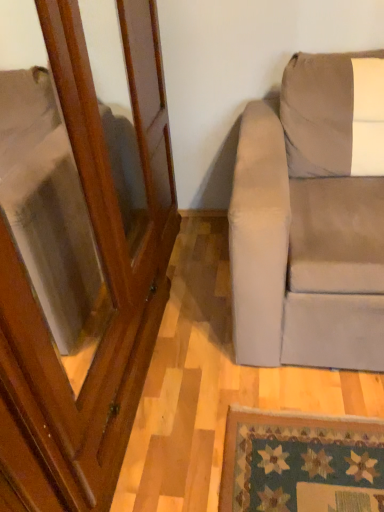
Locate an element on the screen. This screenshot has width=384, height=512. wooden screen door at left is located at coordinates (79, 261).

Image resolution: width=384 pixels, height=512 pixels. Describe the element at coordinates (79, 261) in the screenshot. I see `wooden screen door at left` at that location.

Where is `suede beige couch at right`? suede beige couch at right is located at coordinates (311, 218).

Measure the distance between suede beige couch at right and camera.

suede beige couch at right is 3.65 feet away from camera.

Describe the element at coordinates (311, 218) in the screenshot. This screenshot has width=384, height=512. I see `suede beige couch at right` at that location.

Where is `wooden screen door at left`? This screenshot has height=512, width=384. wooden screen door at left is located at coordinates (79, 261).

Based on the photo, which is more to the left, suede beige couch at right or wooden screen door at left?

Positioned to the left is wooden screen door at left.

Is suede beige couch at right positioned before wooden screen door at left?

No, suede beige couch at right is behind wooden screen door at left.

Does point (256, 346) appear closer or farther from the camera than point (114, 130)?

Point (256, 346) appears to be closer to the viewer than point (114, 130).

From the image's perspective, is suede beige couch at right above or below wooden screen door at left?

Clearly, from the image's perspective, suede beige couch at right is above wooden screen door at left.

From a real-world perspective, relative to wooden screen door at left, is suede beige couch at right vertically above or below?

From a real-world perspective, suede beige couch at right is physically below wooden screen door at left.

In terms of width, does suede beige couch at right look wider or thinner when compared to wooden screen door at left?

Clearly, suede beige couch at right has more width compared to wooden screen door at left.

Considering the sizes of objects suede beige couch at right and wooden screen door at left in the image provided, who is taller, suede beige couch at right or wooden screen door at left?

wooden screen door at left.

Who is bigger, suede beige couch at right or wooden screen door at left?

wooden screen door at left.

Is suede beige couch at right situated inside wooden screen door at left or outside?

The correct answer is: outside.

Are suede beige couch at right and wooden screen door at left making contact?

They are not placed beside each other.

Is suede beige couch at right positioned with its back to wooden screen door at left?

No, suede beige couch at right's orientation is not away from wooden screen door at left.

How far apart are suede beige couch at right and wooden screen door at left?

suede beige couch at right is 56.94 centimeters away from wooden screen door at left.

You are a GUI agent. You are given a task and a screenshot of the screen. Output one action in this format:
    pyautogui.click(x=<x>, y=<y>)
    Task: Click on the screen door lying below the suede beige couch at right (from the image's perspective)
    The width and height of the screenshot is (384, 512).
    Given the screenshot: What is the action you would take?
    pyautogui.click(x=79, y=261)

Between wooden screen door at left and suede beige couch at right, which one appears on the right side from the viewer's perspective?

suede beige couch at right.

Relative to suede beige couch at right, is wooden screen door at left in front or behind?

In the image, wooden screen door at left appears in front of suede beige couch at right.

Considering the points (51, 382) and (282, 185), which point is in front, point (51, 382) or point (282, 185)?

The point (51, 382) is closer.

From the image's perspective, would you say wooden screen door at left is shown under suede beige couch at right?

Indeed, from the image's perspective, wooden screen door at left is shown beneath suede beige couch at right.

From a real-world perspective, is wooden screen door at left under suede beige couch at right?

No.

Looking at their sizes, would you say wooden screen door at left is wider or thinner than suede beige couch at right?

Considering their sizes, wooden screen door at left looks slimmer than suede beige couch at right.

Does wooden screen door at left have a lesser height compared to suede beige couch at right?

In fact, wooden screen door at left may be taller than suede beige couch at right.

Who is bigger, wooden screen door at left or suede beige couch at right?

With larger size is wooden screen door at left.

Would you say wooden screen door at left contains suede beige couch at right?

No, suede beige couch at right is located outside of wooden screen door at left.

Is the surface of wooden screen door at left in direct contact with suede beige couch at right?

No, wooden screen door at left is not with suede beige couch at right.

Is wooden screen door at left turned away from suede beige couch at right?

wooden screen door at left does not have its back to suede beige couch at right.

Can you tell me how much wooden screen door at left and suede beige couch at right differ in facing direction?

There is a 89.7-degree angle between the facing directions of wooden screen door at left and suede beige couch at right.

Locate an element on the screen. The height and width of the screenshot is (512, 384). screen door located below the suede beige couch at right (from the image's perspective) is located at coordinates (79, 261).

At what (x,y) coordinates should I click in order to perform the action: click on studio couch directly beneath the wooden screen door at left (from a real-world perspective). Please return your answer as a coordinate pair (x, y). The image size is (384, 512). Looking at the image, I should click on (311, 218).

Where is `studio couch that appears above the wooden screen door at left (from the image's perspective)`? studio couch that appears above the wooden screen door at left (from the image's perspective) is located at coordinates tap(311, 218).